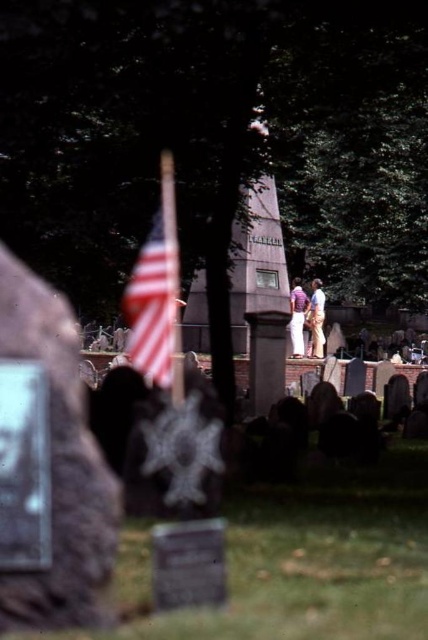
Which of these two, purple cotton shirt at center or light purple shirt at center, stands shorter?

light purple shirt at center is shorter.

The image size is (428, 640). Describe the element at coordinates (297, 317) in the screenshot. I see `purple cotton shirt at center` at that location.

Is point (303, 321) behind point (320, 330)?

Yes, point (303, 321) is behind point (320, 330).

Find the location of `purple cotton shirt at center`. purple cotton shirt at center is located at coordinates (297, 317).

Between american flag at center and light purple shirt at center, which one is positioned higher?

Positioned higher is light purple shirt at center.

Is point (160, 360) more distant than point (315, 289)?

No, (160, 360) is in front of (315, 289).

Between point (133, 336) and point (317, 301), which one is positioned in front?

Positioned in front is point (133, 336).

Find the location of a particular element. The image size is (428, 640). american flag at center is located at coordinates (151, 307).

Can you confirm if american flag at center is positioned below purple cotton shirt at center?

Yes.

Is american flag at center taller than purple cotton shirt at center?

No.

Is point (169, 310) positioned before point (294, 282)?

Yes, point (169, 310) is closer to viewer.

Identify the location of american flag at center. The width and height of the screenshot is (428, 640). (151, 307).